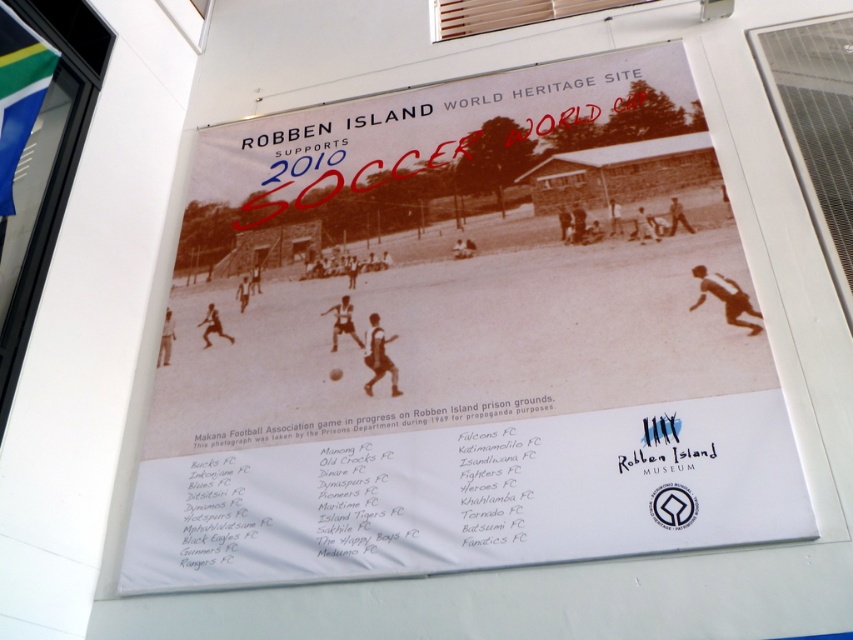
You are standing in front of the poster and want to touch both the black paper poster at center and the green fabric flag at upper left. Which object will you need to reach out further to touch?

The green fabric flag at upper left requires reaching further because it is farther from the viewer compared to the black paper poster at center.

You are an event planner organizing a heritage day at Robben Island. You have both the black paper poster at center and the green fabric flag at upper left. Which object would be more effective for drawing attention from a distance?

The black paper poster at center is larger in size compared to the green fabric flag at upper left, making it more visible from a distance.